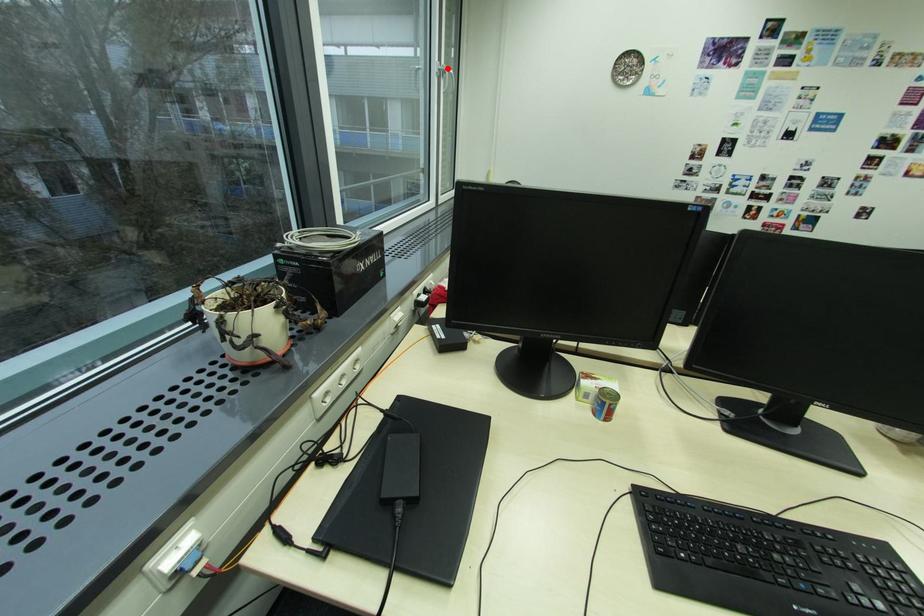
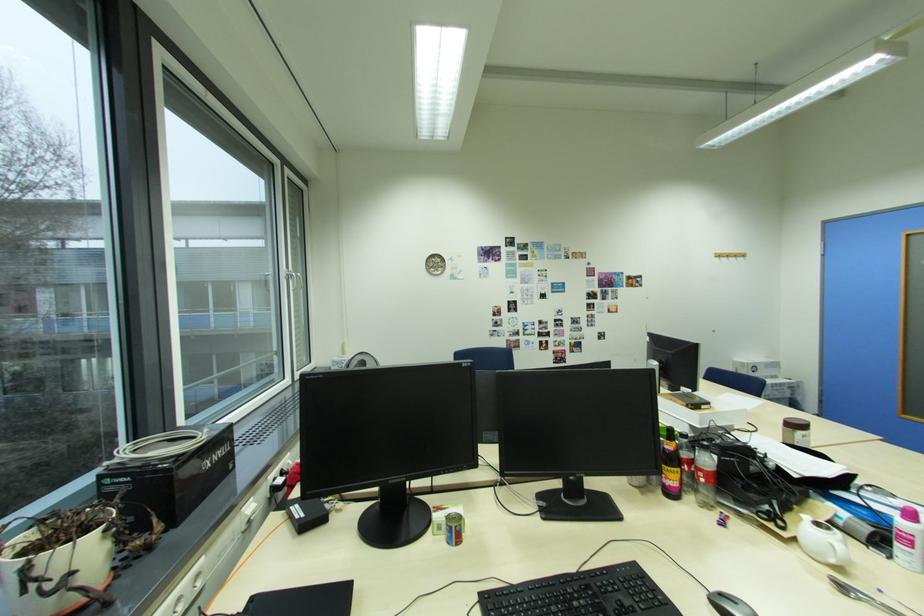
The point at the highlighted location is marked in the first image. Where is the corresponding point in the second image?

(296, 274)